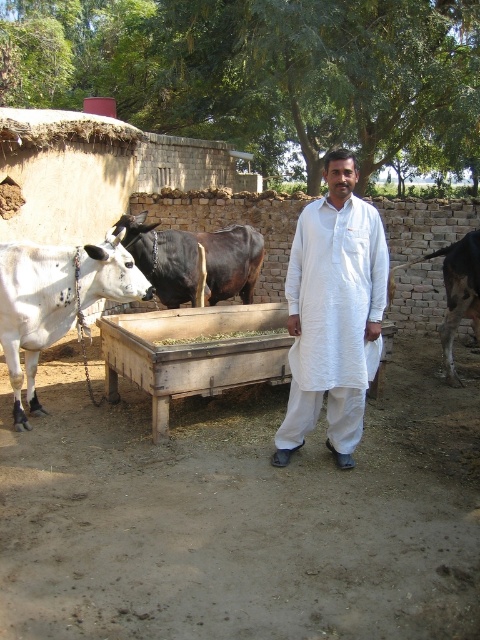
Is point (302, 250) positioned in front of point (94, 298)?

Yes, point (302, 250) is closer to viewer.

Find the location of a particular element. This screenshot has height=640, width=480. white cotton kurta at center is located at coordinates (333, 310).

The height and width of the screenshot is (640, 480). I want to click on white cotton kurta at center, so click(x=333, y=310).

Who is more distant from viewer, (301, 429) or (474, 292)?

The point (474, 292) is more distant.

The height and width of the screenshot is (640, 480). Describe the element at coordinates (333, 310) in the screenshot. I see `white cotton kurta at center` at that location.

Where is `white cotton kurta at center`? Image resolution: width=480 pixels, height=640 pixels. white cotton kurta at center is located at coordinates (333, 310).

Which is behind, point (44, 291) or point (163, 260)?

Point (163, 260)

Based on the photo, which is more to the right, white glossy cow at left or black glossy bull at center?

black glossy bull at center is more to the right.

Which is in front, point (39, 330) or point (252, 232)?

Point (39, 330) is in front.

The width and height of the screenshot is (480, 640). Find the location of `white glossy cow at left`. white glossy cow at left is located at coordinates (55, 300).